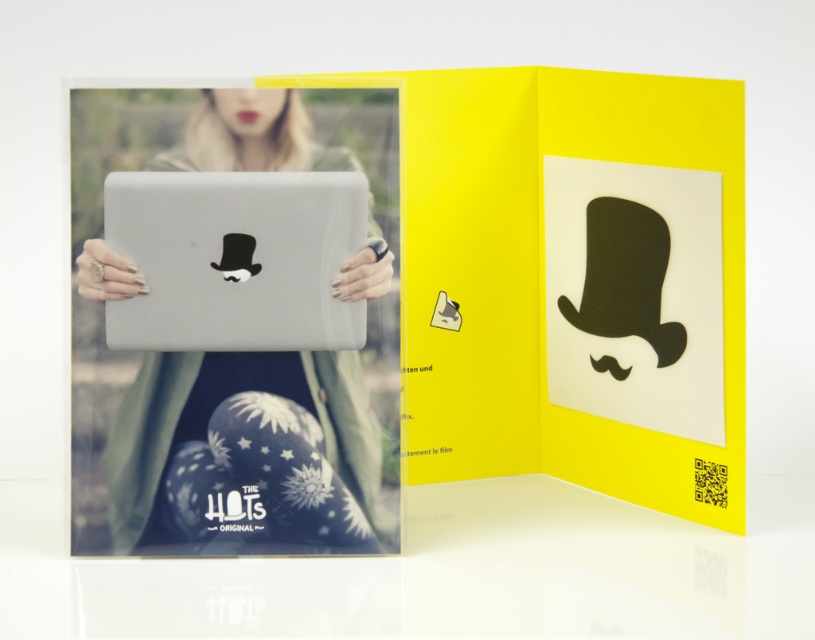
Which of these two, blonde hair at center or satin silver laptop at center, stands taller?

Standing taller between the two is blonde hair at center.

Is the position of blonde hair at center less distant than that of satin silver laptop at center?

No, blonde hair at center is further to the viewer.

Between point (245, 122) and point (302, 268), which one is positioned in front?

Point (302, 268) is more forward.

Locate an element on the screen. This screenshot has width=815, height=640. blonde hair at center is located at coordinates (228, 440).